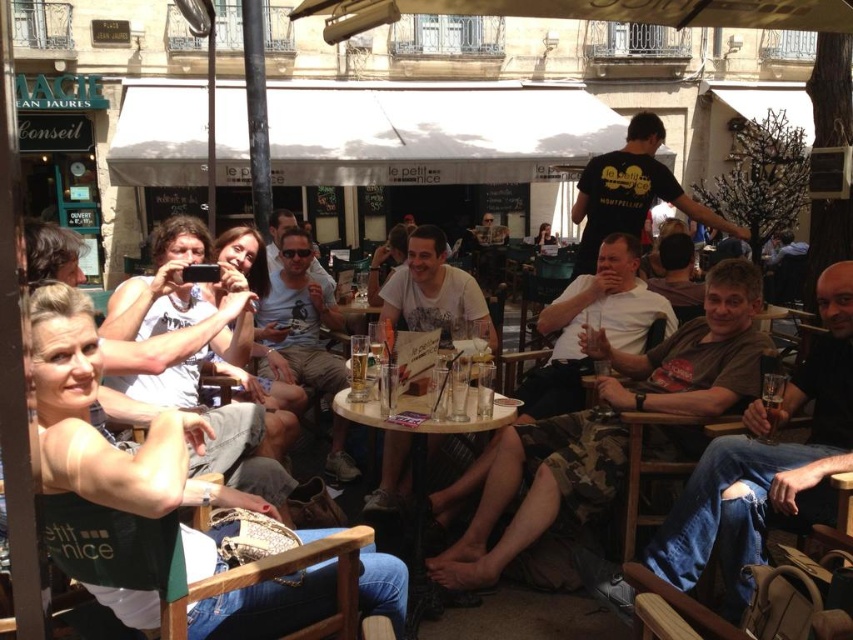
In the lively outdoor cafe scene, there are several small round wooden tables with glasses of beer. One of these tables is marked by the point coordinates at (x=469, y=420). Which object at this coordinate is made of translucent material?

The translucent glass table at center is located at the point coordinates (x=469, y=420).

You are a photographer trying to capture a clear shot of both the camouflage pants at center and the translucent glass beverage at lower right. Which object should you focus on first to ensure both are in focus?

You should focus on the camouflage pants at center first because it is closer to you than the translucent glass beverage at lower right, so adjusting focus from near to far will help both be in focus.

Consider the image. You are a photographer trying to capture the camouflage pants at center and the translucent glass beverage at lower right in a single frame. Given that your camera can only focus on objects larger than 10 cm, will both items be in focus?

The camouflage pants at center is larger in size than the translucent glass beverage at lower right. Since the camera requires objects to be larger than 10 cm to focus, and the camouflage pants are bigger, they will definitely be in focus. However, the beverage might not meet the size requirement if it is smaller than 10 cm. Without knowing the exact size of the beverage, we can only confirm the camouflage pants will be in focus.